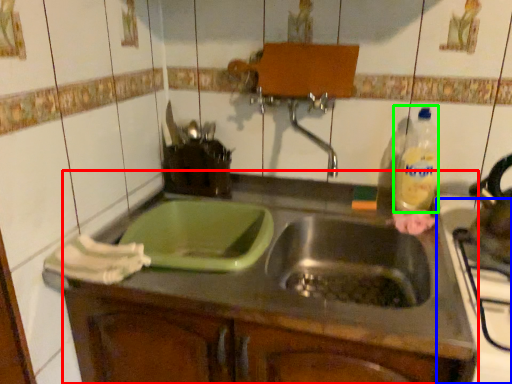
Question: Based on their relative distances, which object is nearer to countertop (highlighted by a red box)? Choose from appliance (highlighted by a blue box) and bottle (highlighted by a green box).

Choices:
 (A) appliance
 (B) bottle

Answer: (A)